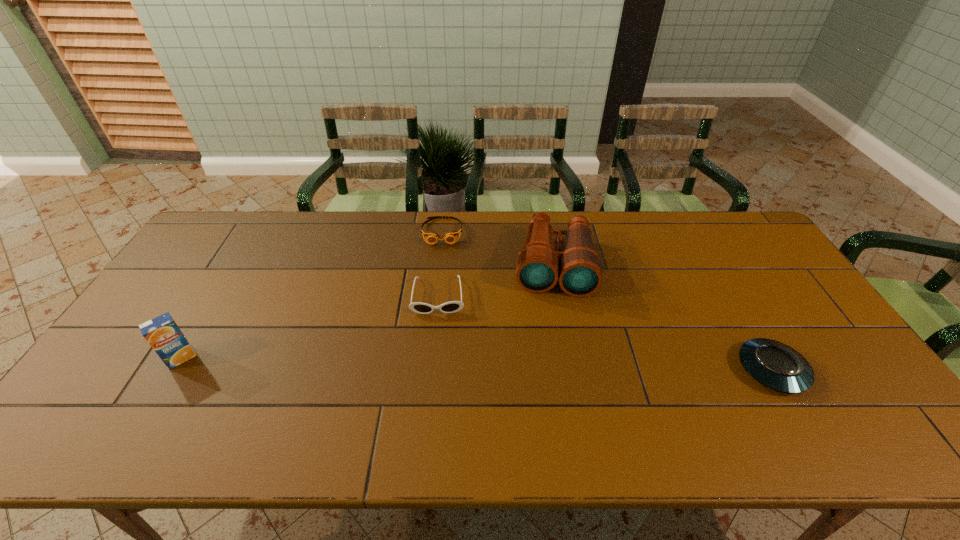
At what (x,y) coordinates should I click in order to perform the action: click on object at the right edge. Please return your answer as a coordinate pair (x, y). Looking at the image, I should click on (775, 365).

Find the location of a particular element. The height and width of the screenshot is (540, 960). object located at the near right corner is located at coordinates (775, 365).

Locate an element on the screen. free space at the far edge of the desktop is located at coordinates (471, 251).

The width and height of the screenshot is (960, 540). In the image, there is a desktop. Find the location of `vacant space at the near edge`. vacant space at the near edge is located at coordinates coord(790,398).

I want to click on free region at the left edge, so click(163, 364).

In the image, there is a desktop. At what (x,y) coordinates should I click in order to perform the action: click on blank space at the far left corner. Please return your answer as a coordinate pair (x, y). This screenshot has width=960, height=540. Looking at the image, I should click on (258, 223).

Locate an element on the screen. vacant space at the near left corner of the desktop is located at coordinates (134, 384).

Locate an element on the screen. This screenshot has height=540, width=960. vacant area that lies between the saucer and the goggles is located at coordinates (607, 301).

Where is `free spot between the orange_juice and the saucer`? This screenshot has width=960, height=540. free spot between the orange_juice and the saucer is located at coordinates (476, 364).

Locate an element on the screen. free spot between the sunglasses and the rightmost object is located at coordinates (605, 333).